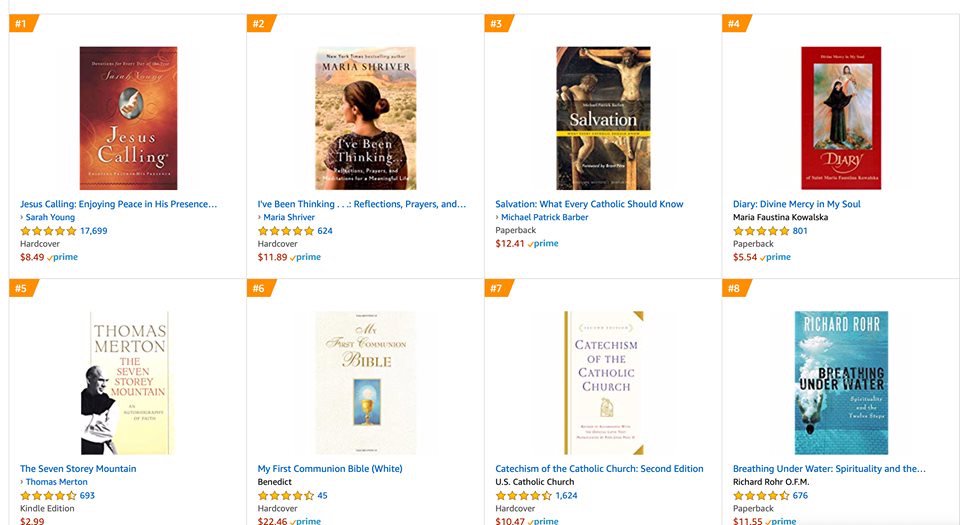
Locate an element on the screen. This screenshot has height=525, width=960. book covers is located at coordinates (130, 131), (356, 152), (589, 147), (818, 153), (837, 436), (602, 361), (334, 363), (159, 374).